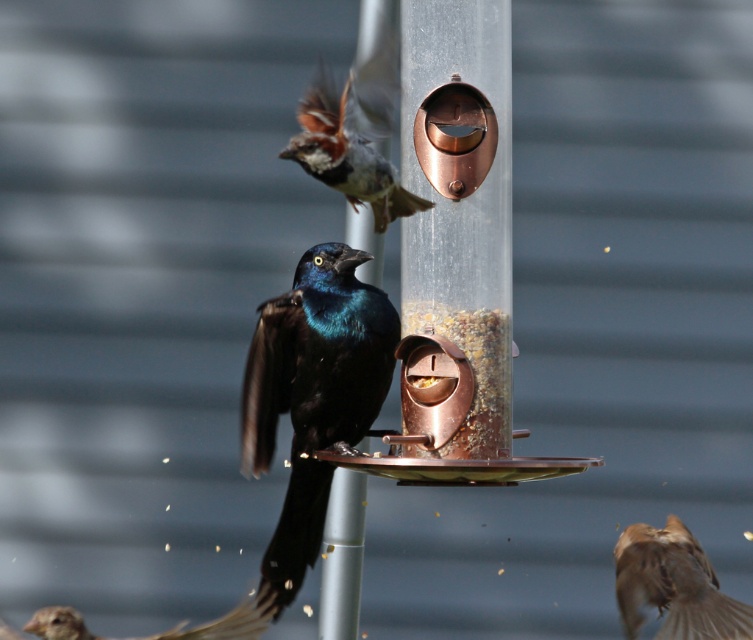
Question: Does brown speckled feathers at upper center have a greater width compared to metallic silver pole at center?

Choices:
 (A) no
 (B) yes

Answer: (B)

Question: Does transparent plastic bird feeder at center have a larger size compared to brown feathered sparrow at lower left?

Choices:
 (A) yes
 (B) no

Answer: (A)

Question: Which point is farther to the camera?

Choices:
 (A) (459, 480)
 (B) (180, 621)
 (C) (407, 202)
 (D) (337, 634)

Answer: (B)

Question: Does transparent plastic bird feeder at center have a larger size compared to metallic silver pole at center?

Choices:
 (A) yes
 (B) no

Answer: (A)

Question: Which of the following is the farthest from the observer?

Choices:
 (A) metallic silver pole at center
 (B) brown speckled feathers at upper center

Answer: (A)

Question: Which point is closer to the camera taking this photo?

Choices:
 (A) (428, 99)
 (B) (745, 628)

Answer: (A)